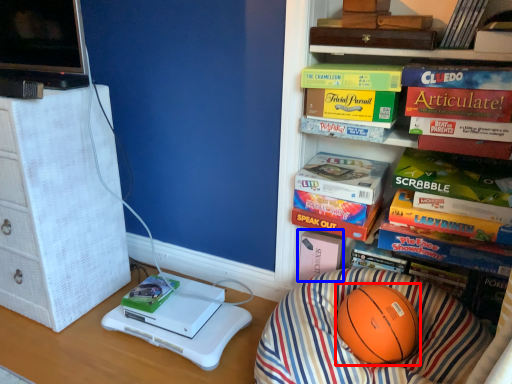
Question: Which object appears closest to the camera in this image, ball (highlighted by a red box) or paperback book (highlighted by a blue box)?

Choices:
 (A) ball
 (B) paperback book

Answer: (A)